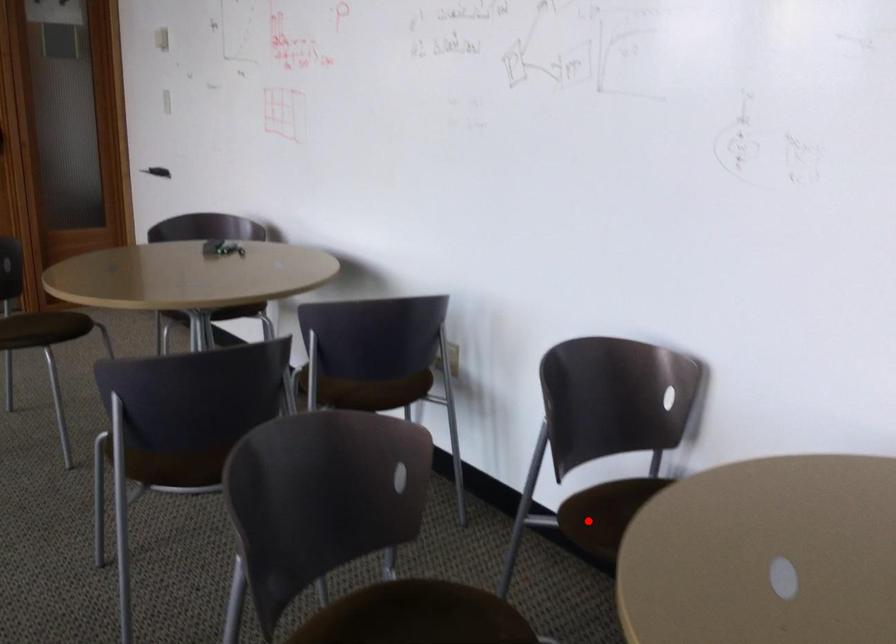
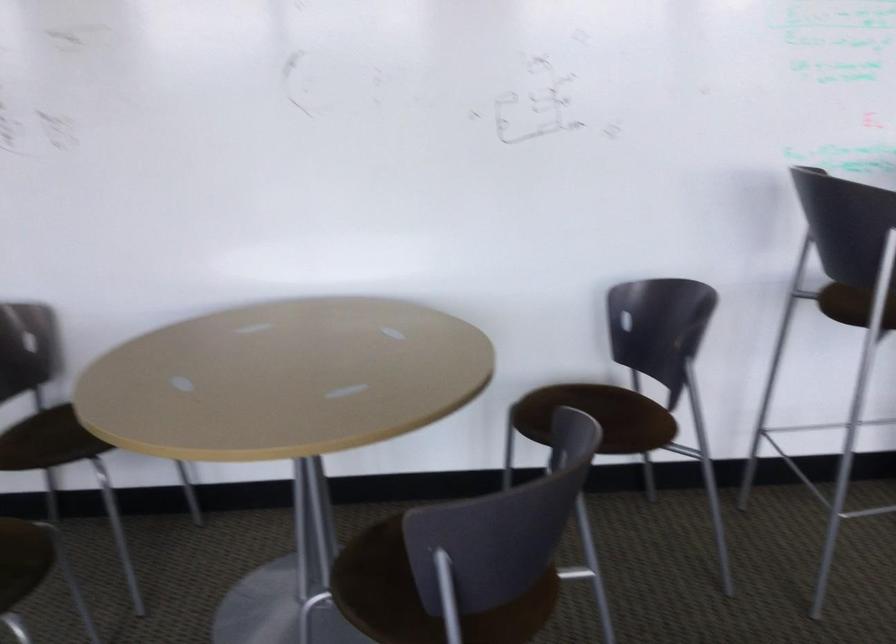
Find the pixel in the second image that matches the highlighted location in the first image.

(26, 442)